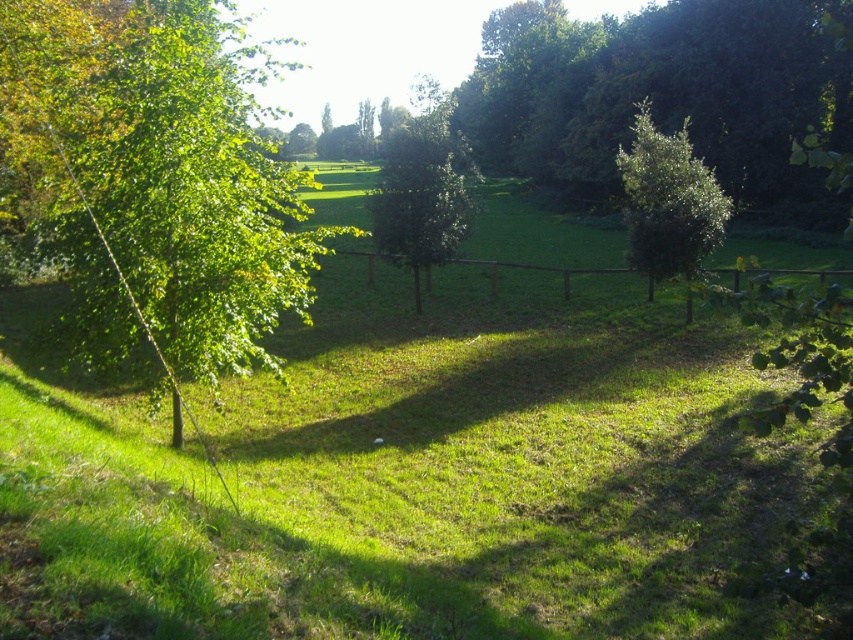
Question: Which object appears closest to the camera in this image?

Choices:
 (A) green leafy tree at left
 (B) green leafy tree at right
 (C) green leafy tree at center

Answer: (A)

Question: Does green leafy tree at left appear on the right side of green leafy tree at center?

Choices:
 (A) yes
 (B) no

Answer: (B)

Question: Which of the following is the closest to the observer?

Choices:
 (A) (705, 172)
 (B) (392, 225)

Answer: (B)

Question: Which object is closer to the camera taking this photo?

Choices:
 (A) green leafy tree at left
 (B) green leafy tree at right
 (C) green leafy tree at center

Answer: (A)

Question: Is the position of green leafy tree at right less distant than that of green leafy tree at center?

Choices:
 (A) no
 (B) yes

Answer: (B)

Question: Does green leafy tree at left come in front of green leafy tree at right?

Choices:
 (A) no
 (B) yes

Answer: (B)